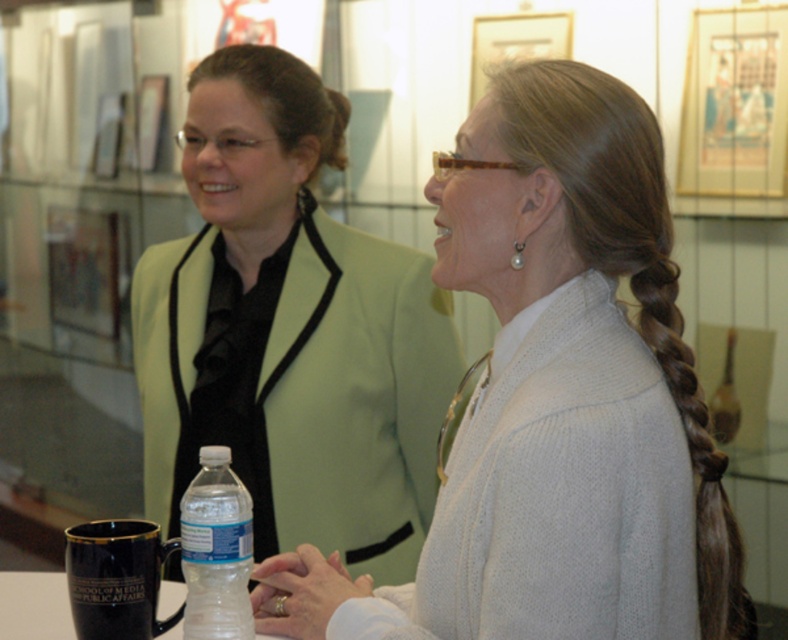
You are standing at the entrance of the gallery and see the black ceramic mug at lower left. Can you estimate its position relative to the entrance?

The black ceramic mug at lower left is located at point 0.905 on the x axis and 0.148 on the y axis relative to the entrance.

You are an assistant at the museum and need to place a large exhibit label next to the matte green blazer at upper left and the clear plastic bottle at lower center. Which object requires a larger label based on their sizes?

The matte green blazer at upper left requires a larger label because it is larger in size than the clear plastic bottle at lower center.

Based on the photo, you are a visitor at the museum and see both the black ceramic mug at lower left and the transparent plastic bottle at lower center on a table. If you want to choose the larger container to fill with water, which one should you pick?

The transparent plastic bottle at lower center is larger than the black ceramic mug at lower left, so you should pick the transparent plastic bottle at lower center to fill with water.